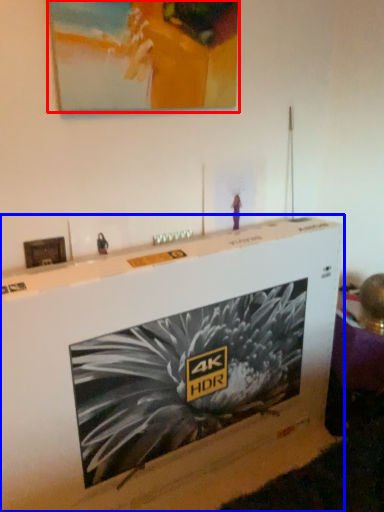
Question: Which of the following is the farthest to the observer, picture frame (highlighted by a red box) or furniture (highlighted by a blue box)?

Choices:
 (A) picture frame
 (B) furniture

Answer: (A)